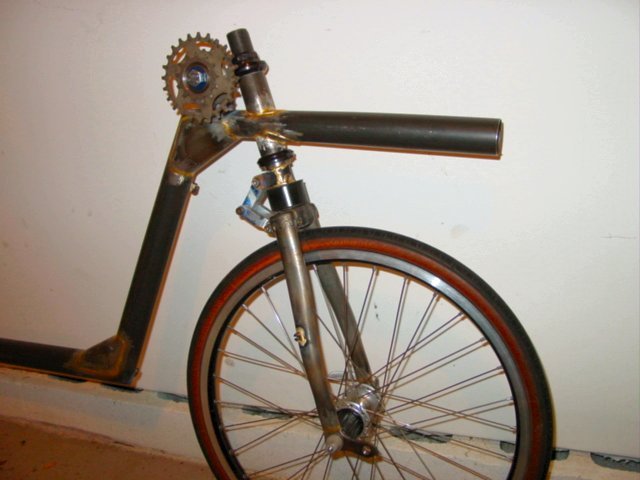
Find the location of a particular element. The image size is (640, 480). baseboard is located at coordinates (166, 432).